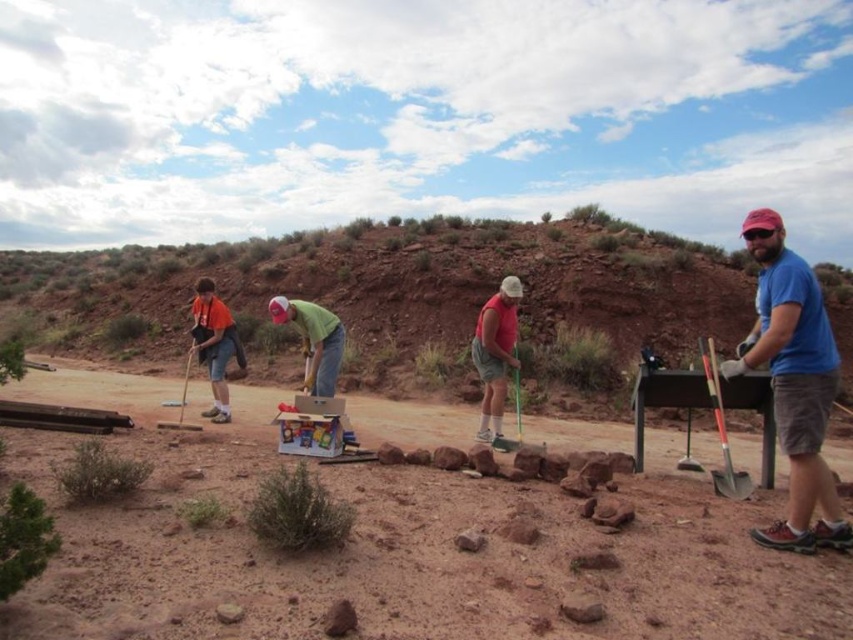
You are standing in the desert scene and want to walk from point A to point B. Point A is at coordinate point [492,328] and point B is at coordinate point [320,356]. Which point is closer to you when you start walking?

Point A at coordinate point [492,328] is closer to you because it is further to the viewer than point B at coordinate point [320,356].